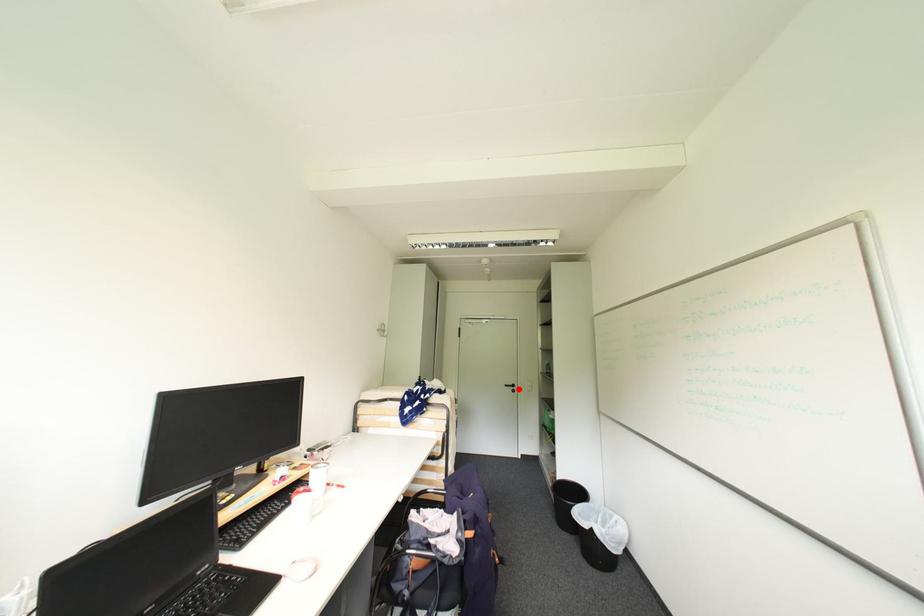
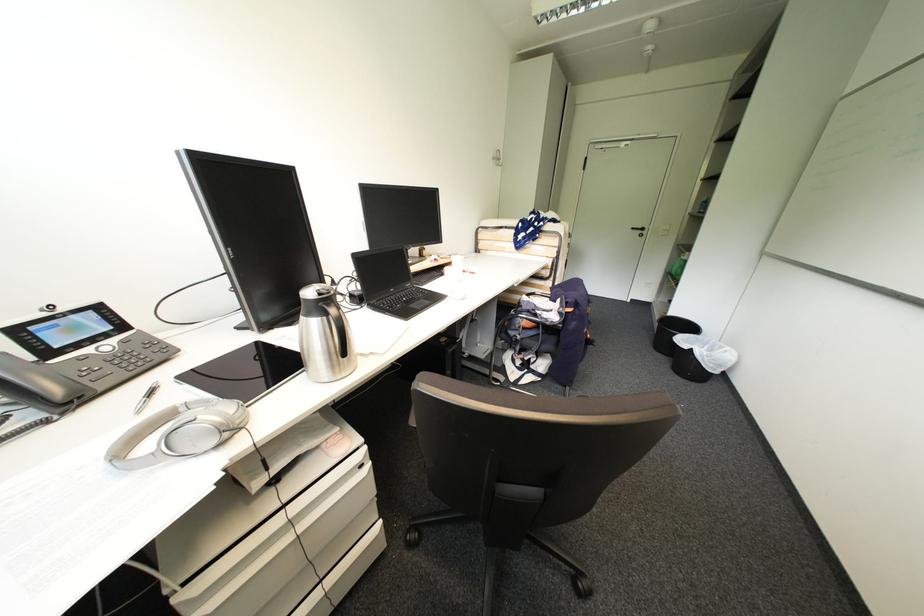
Locate, in the second image, the point that corresponds to the highlighted location in the first image.

(648, 233)